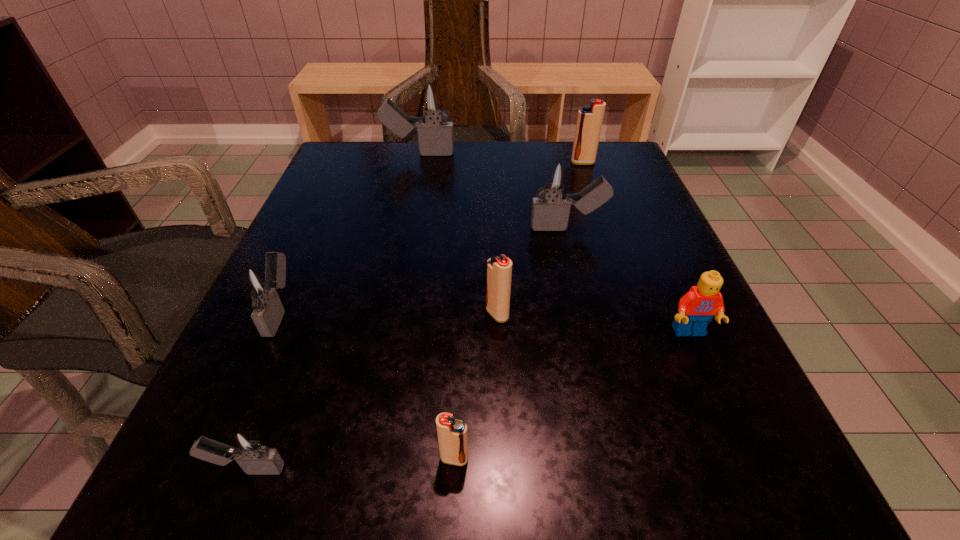
You are a GUI agent. You are given a task and a screenshot of the screen. Output one action in this format:
    pyautogui.click(x=<x>, y=<y>)
    Task: Click on the free space between the third biggest gray igniter and the Lego
    The height and width of the screenshot is (540, 960).
    Given the screenshot: What is the action you would take?
    pyautogui.click(x=485, y=321)

Choose which object is the fourth nearest neighbor to the rightmost object. Please provide its 2D coordinates. Your answer should be formatted as a tuple, i.e. [(x, y)], where the tuple contains the x and y coordinates of a point satisfying the conditions above.

[(589, 122)]

Identify which object is the fourth closest to the biggest red igniter. Please provide its 2D coordinates. Your answer should be formatted as a tuple, i.e. [(x, y)], where the tuple contains the x and y coordinates of a point satisfying the conditions above.

[(697, 307)]

Point out which igniter is positioned as the sixth nearest to the nearest red igniter. Please provide its 2D coordinates. Your answer should be formatted as a tuple, i.e. [(x, y)], where the tuple contains the x and y coordinates of a point satisfying the conditions above.

[(589, 122)]

At what (x,y) coordinates should I click in order to perform the action: click on igniter that stands as the closest to the fourth igniter from left to right. Please return your answer as a coordinate pair (x, y). The width and height of the screenshot is (960, 540). Looking at the image, I should click on (246, 445).

Identify which gray igniter is the third closest to the rightmost object. Please provide its 2D coordinates. Your answer should be formatted as a tuple, i.e. [(x, y)], where the tuple contains the x and y coordinates of a point satisfying the conditions above.

[(260, 285)]

In order to click on gray igniter object that ranks as the closest to the third farthest gray igniter in this screenshot , I will do `click(246, 445)`.

Where is `red igniter that can be found as the second closest to the leftmost red igniter`? This screenshot has height=540, width=960. red igniter that can be found as the second closest to the leftmost red igniter is located at coordinates (589, 122).

The image size is (960, 540). What are the coordinates of `red igniter that stands as the closest to the leftmost red igniter` in the screenshot? It's located at (499, 269).

Where is `free space that satisfies the following two spatial constraints: 1. on the front side of the nearest gray igniter; 2. on the right side of the second nearest gray igniter`? Image resolution: width=960 pixels, height=540 pixels. free space that satisfies the following two spatial constraints: 1. on the front side of the nearest gray igniter; 2. on the right side of the second nearest gray igniter is located at coordinates (210, 469).